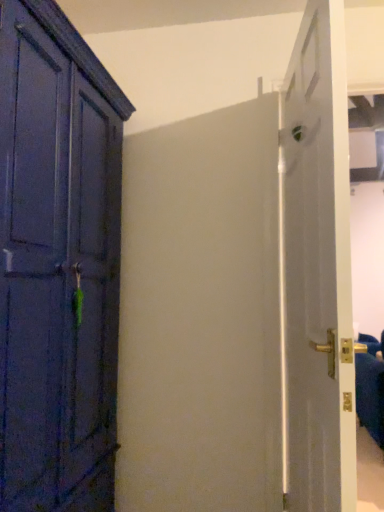
Question: Is white glossy door at right wider or thinner than gold metallic door handle at right?

Choices:
 (A) thin
 (B) wide

Answer: (A)

Question: Considering the positions of white glossy door at right and gold metallic door handle at right in the image, is white glossy door at right taller or shorter than gold metallic door handle at right?

Choices:
 (A) short
 (B) tall

Answer: (B)

Question: In the image, is white glossy door at right positioned in front of or behind gold metallic door handle at right?

Choices:
 (A) behind
 (B) front

Answer: (B)

Question: From a real-world perspective, relative to white glossy door at right, is gold metallic door handle at right vertically above or below?

Choices:
 (A) below
 (B) above

Answer: (A)

Question: Visually, is gold metallic door handle at right positioned to the left or to the right of white glossy door at right?

Choices:
 (A) left
 (B) right

Answer: (B)

Question: In terms of width, does gold metallic door handle at right look wider or thinner when compared to white glossy door at right?

Choices:
 (A) thin
 (B) wide

Answer: (B)

Question: Does point (377, 374) appear closer or farther from the camera than point (309, 203)?

Choices:
 (A) closer
 (B) farther

Answer: (B)